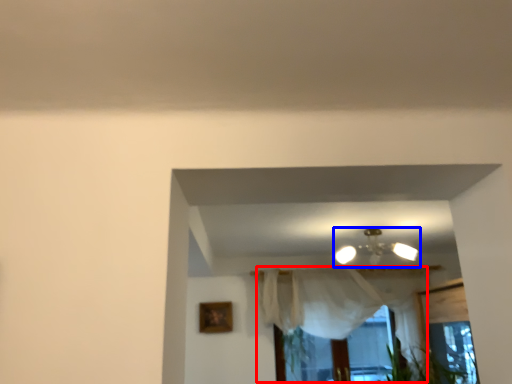
Question: Which of the following is the closest to the observer, curtain (highlighted by a red box) or lamp (highlighted by a blue box)?

Choices:
 (A) curtain
 (B) lamp

Answer: (B)